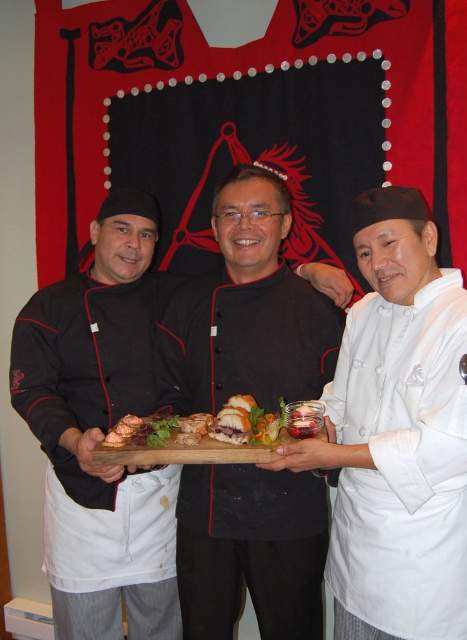
Does point (395, 435) lie in front of point (290, 435)?

Yes, it is in front of point (290, 435).

Is white matte chef coat at center wider than golden brown bread at center?

No.

In order to click on white matte chef coat at center in this screenshot , I will do (396, 435).

Can you confirm if black matte chef's coat at left is smaller than golden brown bread at center?

No, black matte chef's coat at left is not smaller than golden brown bread at center.

Is black matte chef's coat at left further to the viewer compared to golden brown bread at center?

That is True.

Where is `black matte chef's coat at left`? black matte chef's coat at left is located at coordinates (99, 433).

Locate an element on the screen. Image resolution: width=467 pixels, height=640 pixels. black matte chef's coat at left is located at coordinates (99, 433).

How distant is white matte chef coat at center from black matte chef's coat at left?

white matte chef coat at center is 23.14 inches from black matte chef's coat at left.

Can you confirm if white matte chef coat at center is wider than black matte chef's coat at left?

In fact, white matte chef coat at center might be narrower than black matte chef's coat at left.

At what (x,y) coordinates should I click in order to perform the action: click on white matte chef coat at center. Please return your answer as a coordinate pair (x, y). Image resolution: width=467 pixels, height=640 pixels. Looking at the image, I should click on (396, 435).